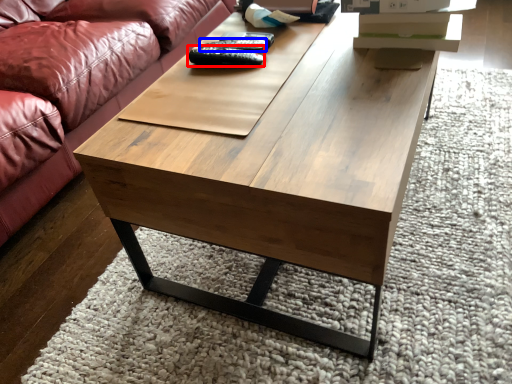
Question: Which point is further to the camera, remote (highlighted by a red box) or remote (highlighted by a blue box)?

Choices:
 (A) remote
 (B) remote

Answer: (B)